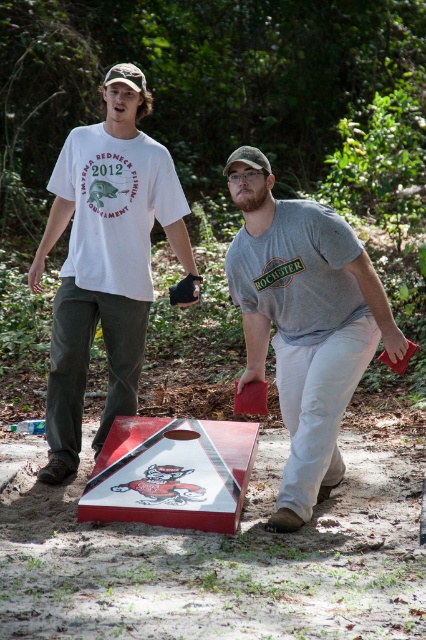
You are setting up a game of cornhole and need to place two boards side by side. Given that the matte red cornhole board at center and the red wood cornhole board at center are both present, which board should you choose if you want the wider one for more space?

The matte red cornhole board at center should be chosen because its width surpasses that of the red wood cornhole board at center, providing more space for the game.

From the picture: You are standing at the point labeled point (x=227, y=497) and want to throw a bean bag to the cornhole board located at point (x=305, y=408). Is the board visible from your current position? Consider the presence of any obstacles between the two points.

Point (x=305, y=408) is behind point (x=227, y=497), so the board at point (x=305, y=408) would be obstructed by the object at point (x=227, y=497), making it not visible from your current position.